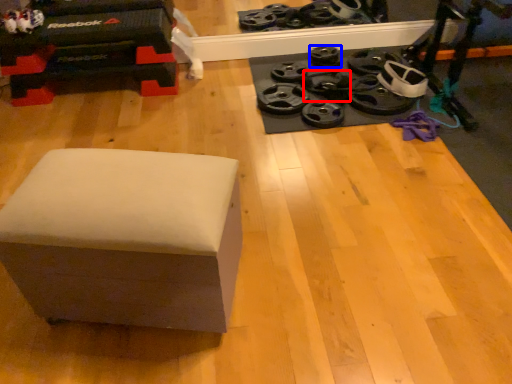
Question: Which point is further to the camera, wheel (highlighted by a red box) or wheel (highlighted by a blue box)?

Choices:
 (A) wheel
 (B) wheel

Answer: (B)